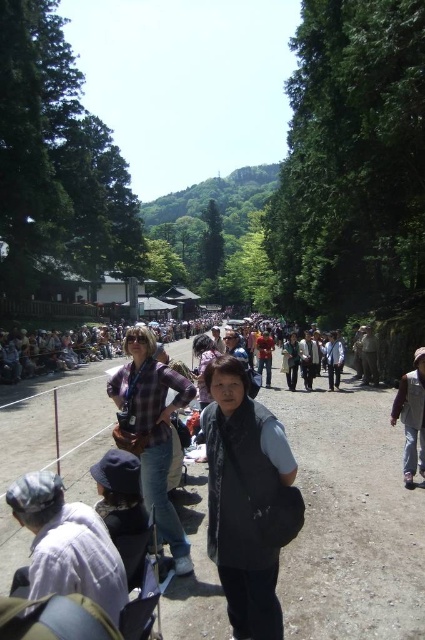
Between black fabric vest at center and light gray fabric hat at lower left, which one is positioned lower?

black fabric vest at center

I want to click on black fabric vest at center, so click(243, 499).

Is brown dirt track at center positioned at the back of black fabric vest at center?

No, brown dirt track at center is in front of black fabric vest at center.

Can you confirm if brown dirt track at center is bigger than black fabric vest at center?

Indeed, brown dirt track at center has a larger size compared to black fabric vest at center.

Is point (387, 516) positioned behind point (255, 502)?

Yes.

I want to click on brown dirt track at center, so click(x=350, y=516).

Who is taller, brown dirt track at center or light gray fabric hat at lower left?

Standing taller between the two is brown dirt track at center.

Measure the distance from brown dirt track at center to light gray fabric hat at lower left.

brown dirt track at center is 41.39 feet away from light gray fabric hat at lower left.

Does point (365, 422) come behind point (47, 531)?

Yes, point (365, 422) is behind point (47, 531).

Locate an element on the screen. This screenshot has height=640, width=425. brown dirt track at center is located at coordinates (350, 516).